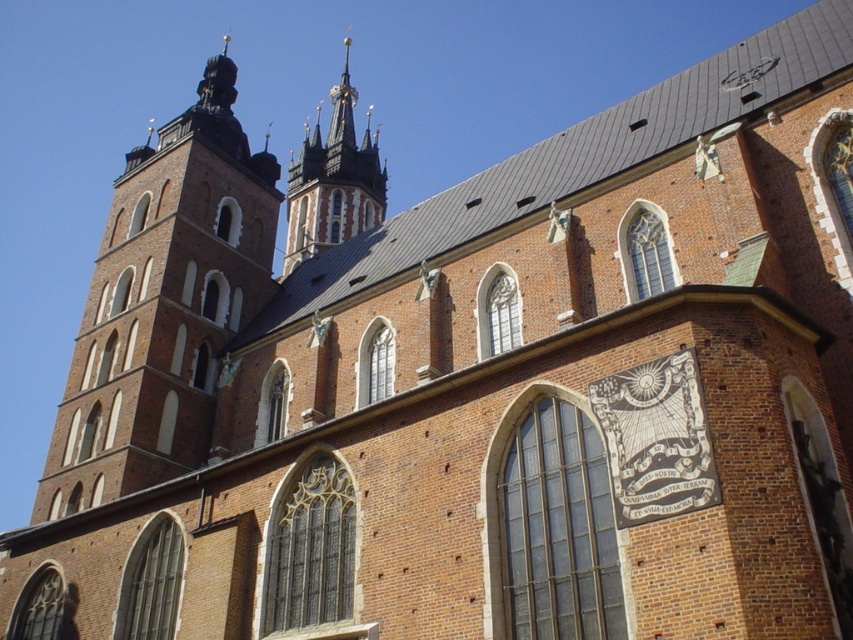
Does brown brick tower at center-left appear under smooth stone spires at upper center?

Incorrect, brown brick tower at center-left is not positioned below smooth stone spires at upper center.

Between brown brick tower at center-left and smooth stone spires at upper center, which one appears on the right side from the viewer's perspective?

From the viewer's perspective, smooth stone spires at upper center appears more on the right side.

Image resolution: width=853 pixels, height=640 pixels. What are the coordinates of `brown brick tower at center-left` in the screenshot? It's located at (163, 305).